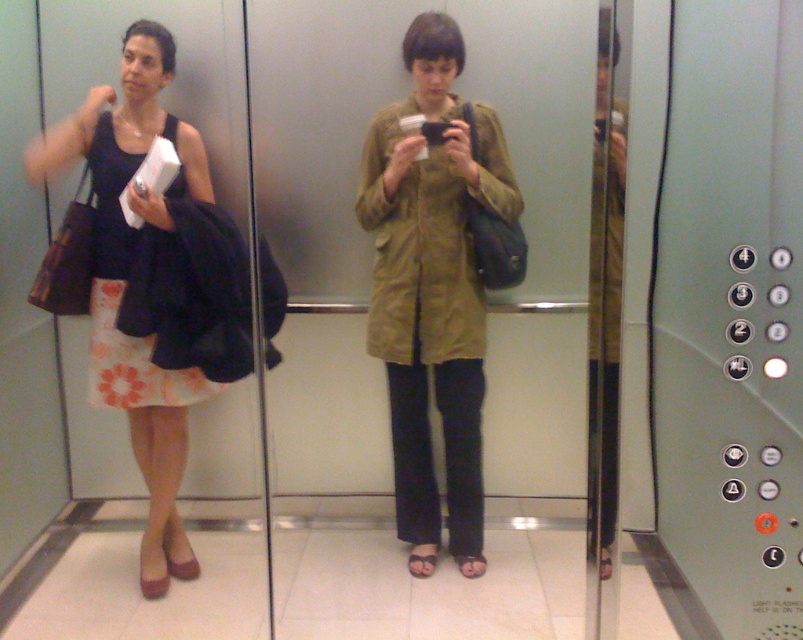
Looking at this image, is green matte coat at center positioned in front of matte olive green jacket at center?

Yes, green matte coat at center is in front of matte olive green jacket at center.

Which is more to the left, green matte coat at center or matte olive green jacket at center?

green matte coat at center is more to the left.

Is point (308, 288) positioned after point (400, 397)?

Yes, it is.

Locate an element on the screen. green matte coat at center is located at coordinates (365, 317).

Does matte olive green jacket at center have a greater width compared to matte black dress at left?

No.

Is matte olive green jacket at center shorter than matte black dress at left?

No.

Does point (454, 353) come behind point (125, 125)?

Yes, it is.

At what (x,y) coordinates should I click in order to perform the action: click on matte olive green jacket at center. Please return your answer as a coordinate pair (x, y). Looking at the image, I should click on (431, 289).

Who is positioned more to the left, green matte coat at center or matte black dress at left?

matte black dress at left

Is point (288, 454) closer to viewer compared to point (128, 404)?

That is False.

At what (x,y) coordinates should I click in order to perform the action: click on green matte coat at center. Please return your answer as a coordinate pair (x, y). Image resolution: width=803 pixels, height=640 pixels. Looking at the image, I should click on (365, 317).